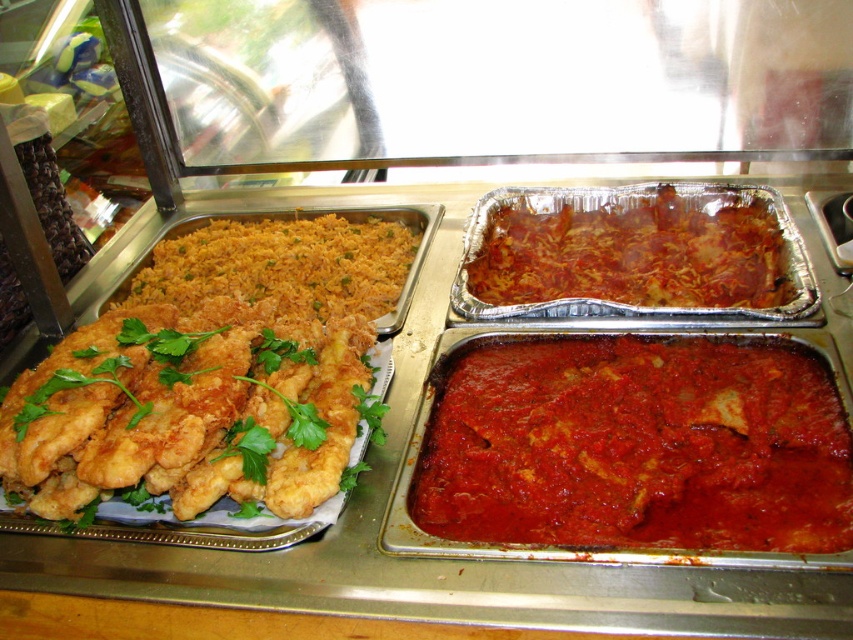
Looking at this image, you are a customer at the buffet and want to compare the positions of the red matte sauce at center and the yellow rice at left. Which one is located to the left?

The yellow rice at left is located to the left of the red matte sauce at center.

You are a customer at the buffet and want to pour the red matte sauce at center onto the yellow rice at left. Can you do this without spilling, considering their heights?

The red matte sauce at center is shorter than yellow rice at left, so you can pour the red matte sauce at center onto the yellow rice at left without spilling since the sauce container is lower than the rice.

In the scene shown: What is the object located at point coordinates (x=631, y=252)?

The object located at point coordinates (x=631, y=252) is the red matte lasagna at center.